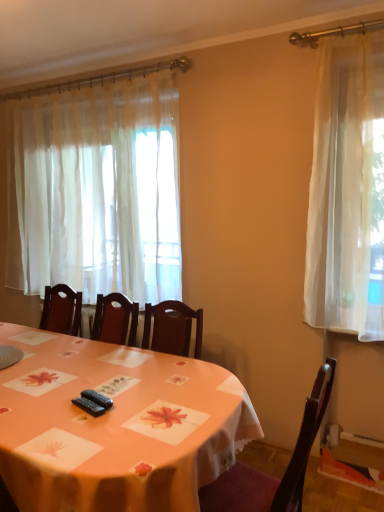
Question: From a real-world perspective, is sheer white curtain at left physically located above or below wooden chair at center?

Choices:
 (A) above
 (B) below

Answer: (A)

Question: Is sheer white curtain at left bigger or smaller than wooden chair at center?

Choices:
 (A) small
 (B) big

Answer: (B)

Question: Which object is the farthest from the orange fabric table at center?

Choices:
 (A) wooden chair at center
 (B) sheer white curtain at left

Answer: (B)

Question: Which is nearer to the sheer white curtain at left?

Choices:
 (A) orange fabric table at center
 (B) wooden chair at center

Answer: (A)